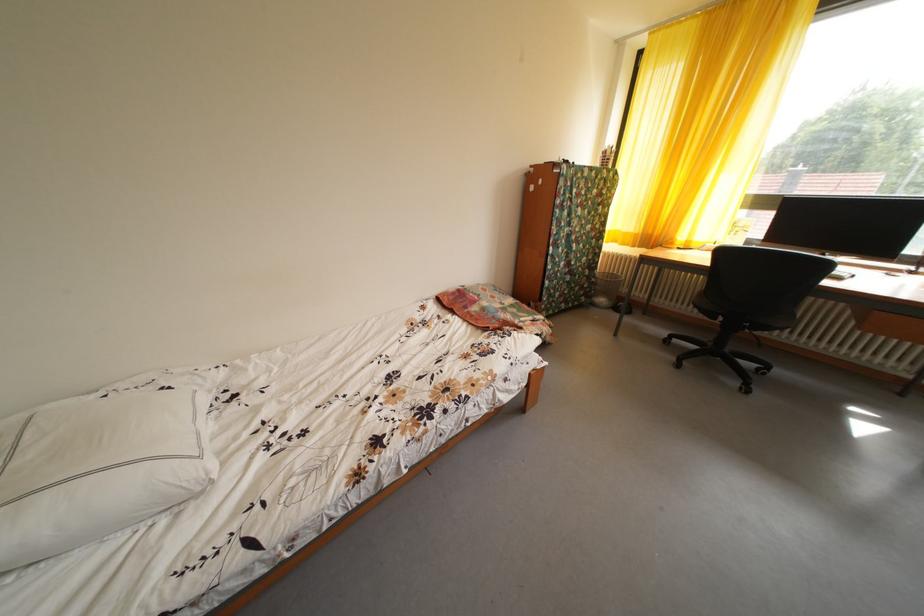
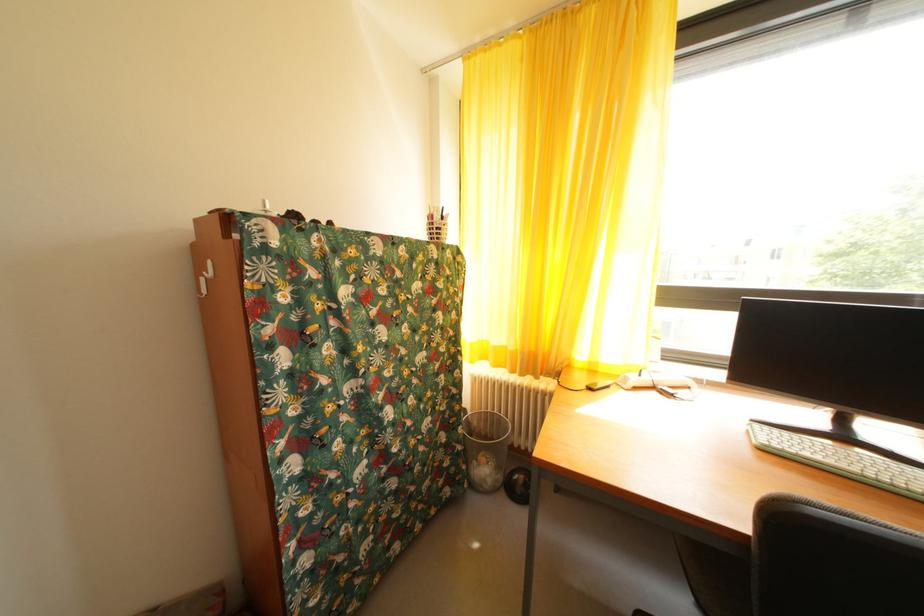
In the second image, find the point that corresponds to pixel 614 159 in the first image.

(440, 223)